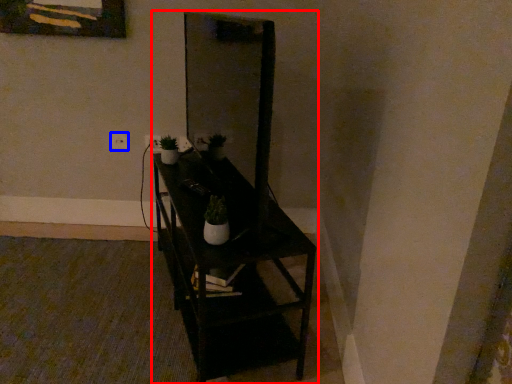
Question: Among these objects, which one is nearest to the camera, furniture (highlighted by a red box) or electric outlet (highlighted by a blue box)?

Choices:
 (A) furniture
 (B) electric outlet

Answer: (A)